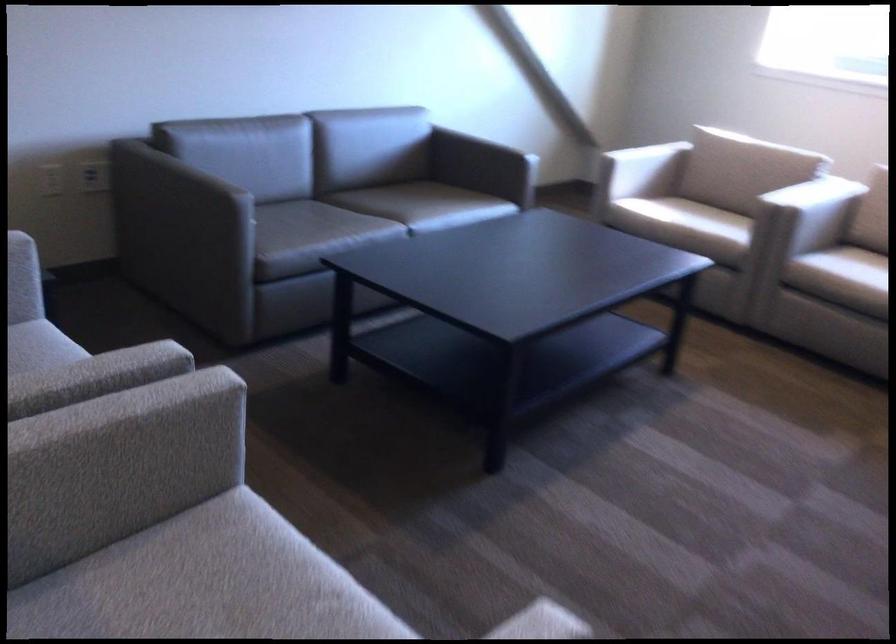
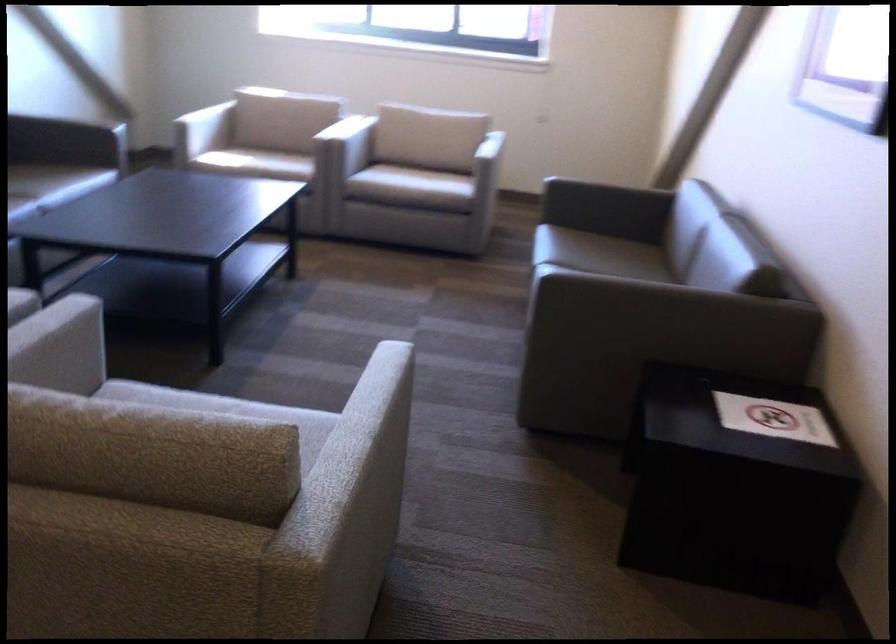
Find the pixel in the second image that matches the point at 700,482 in the first image.

(352, 330)